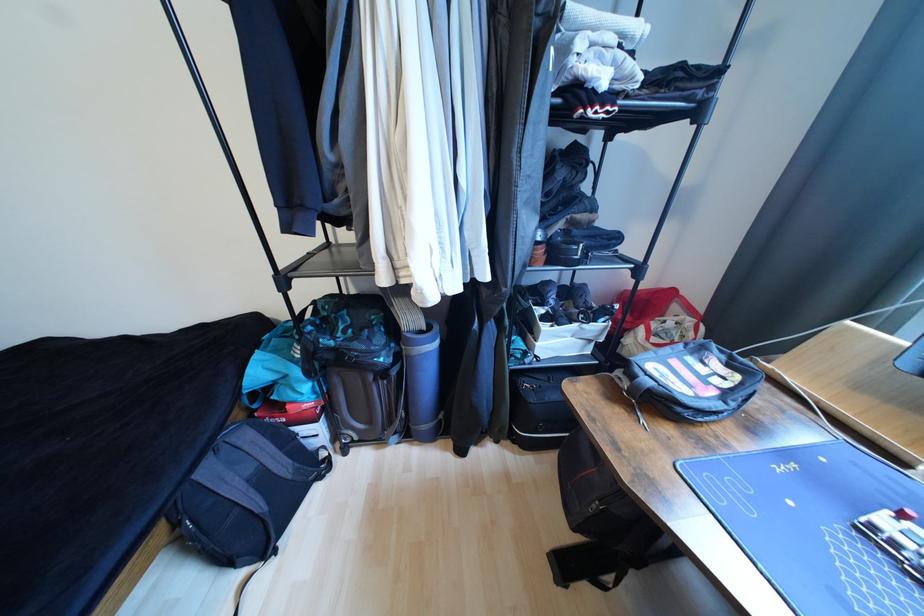
Describe the element at coordinates (246, 492) in the screenshot. This screenshot has width=924, height=616. I see `the small black bag` at that location.